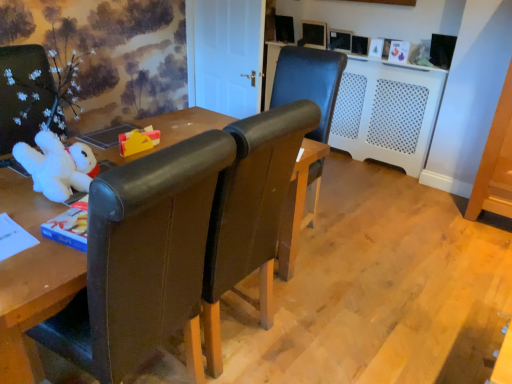
You are a GUI agent. You are given a task and a screenshot of the screen. Output one action in this format:
    pyautogui.click(x=<x>, y=<y>)
    Task: Click on the vacant area that is in front of leather chair at center, the second chair when ordered from front to back
    
    Given the screenshot: What is the action you would take?
    pyautogui.click(x=329, y=271)